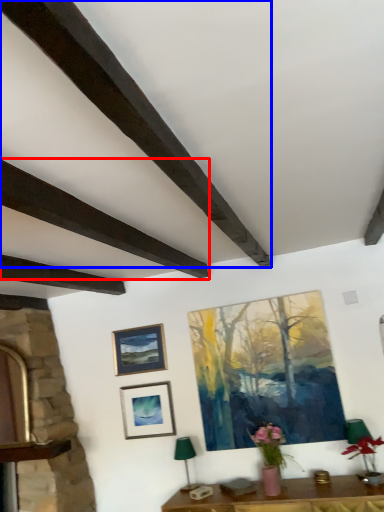
Question: Which point is further to the camera, plank (highlighted by a red box) or plank (highlighted by a blue box)?

Choices:
 (A) plank
 (B) plank

Answer: (A)